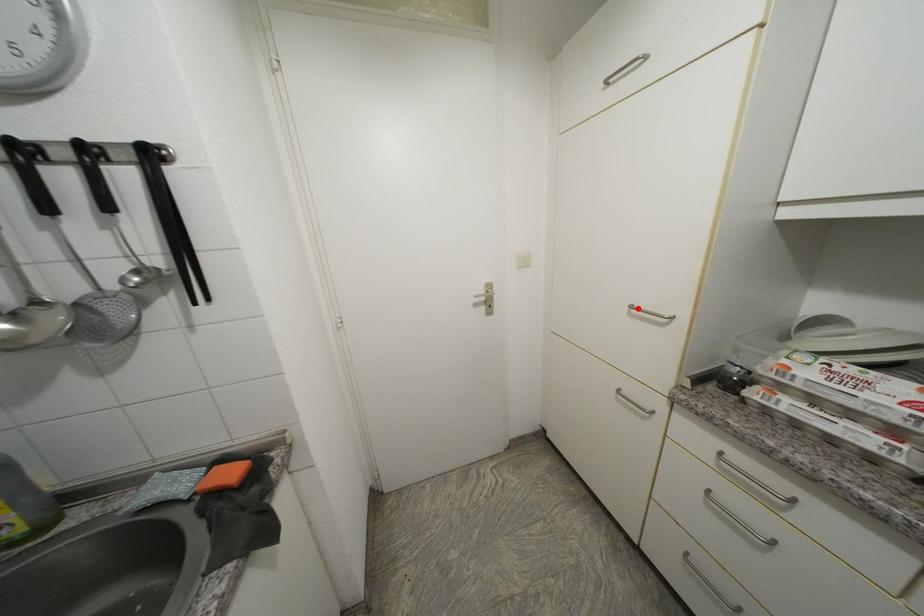
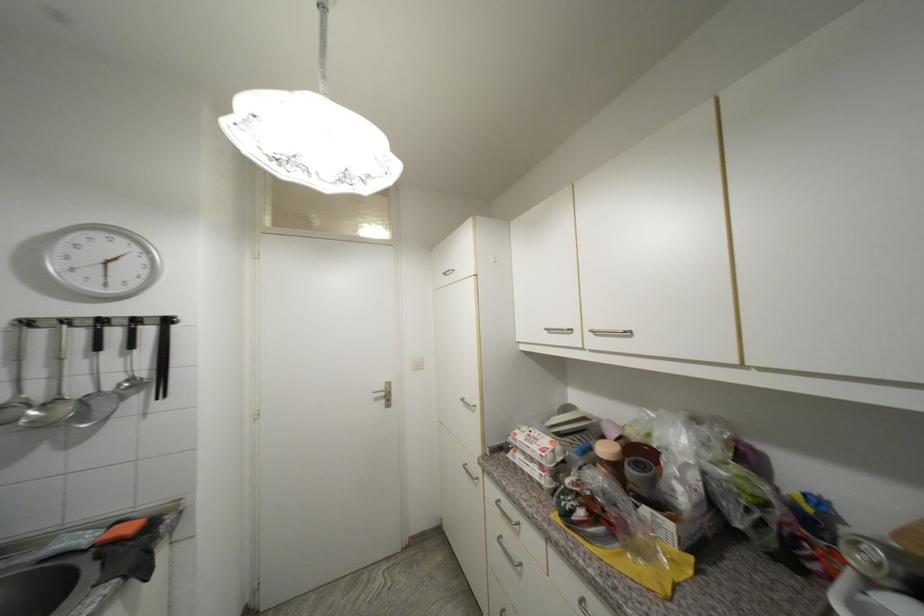
Find the pixel in the second image that matches the highlighted location in the first image.

(468, 400)